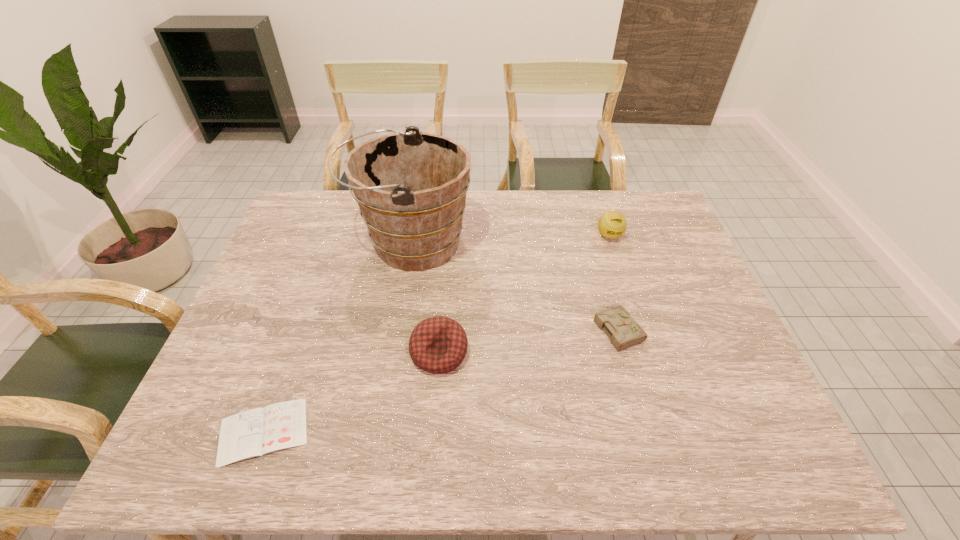
Locate an element on the screen. vacant space situated 0.190m on the logo side of the softball is located at coordinates (627, 289).

What are the coordinates of `vacant area situated 0.060m on the back of the beanbag` in the screenshot? It's located at (443, 312).

Identify the location of vacant space located 0.170m on the right of the right diary. (708, 328).

Find the location of `free region located 0.250m on the right of the shorter diary`. free region located 0.250m on the right of the shorter diary is located at coordinates (428, 432).

At what (x,y) coordinates should I click in order to perform the action: click on bucket at the far edge. Please return your answer as a coordinate pair (x, y). This screenshot has width=960, height=540. Looking at the image, I should click on (411, 187).

You are a GUI agent. You are given a task and a screenshot of the screen. Output one action in this format:
    pyautogui.click(x=<x>, y=<y>)
    Task: Click on the softball at the far edge
    The height and width of the screenshot is (540, 960).
    Given the screenshot: What is the action you would take?
    pyautogui.click(x=612, y=224)

Find the location of a particular element. This screenshot has width=960, height=540. object positioned at the near edge is located at coordinates (255, 432).

The height and width of the screenshot is (540, 960). I want to click on object present at the left edge, so click(x=255, y=432).

Locate an element on the screen. object present at the near left corner is located at coordinates (255, 432).

Identify the location of free location at the far edge. The width and height of the screenshot is (960, 540). (469, 208).